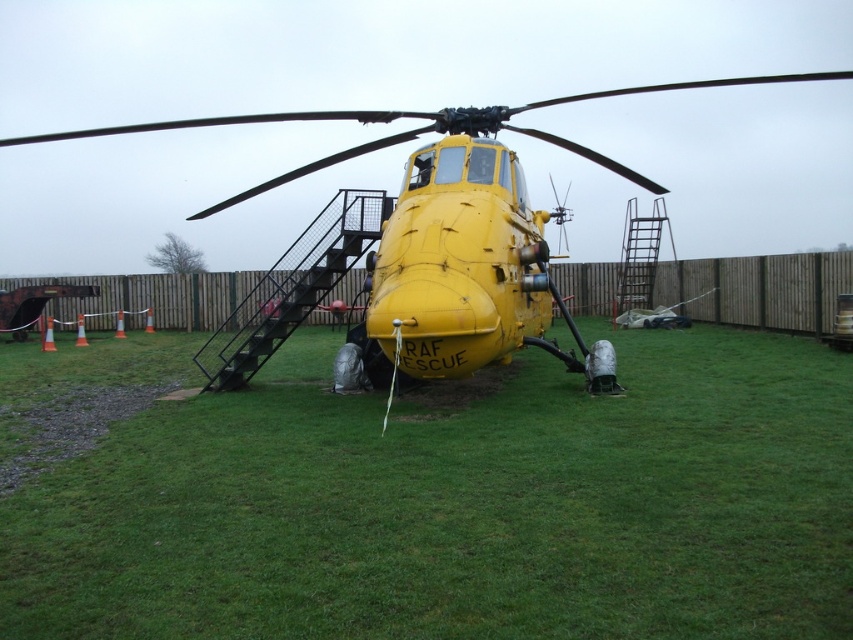
Is green grass at center in front of yellow matte helicopter at center?

Answer: Yes, it is in front of yellow matte helicopter at center.

Is point (252, 401) positioned before point (51, 134)?

Yes, point (252, 401) is closer to viewer.

Who is more distant from viewer, (x=741, y=589) or (x=521, y=129)?

The point (x=521, y=129) is behind.

At what (x,y) coordinates should I click in order to perform the action: click on green grass at center. Please return your answer as a coordinate pair (x, y). Looking at the image, I should click on (428, 496).